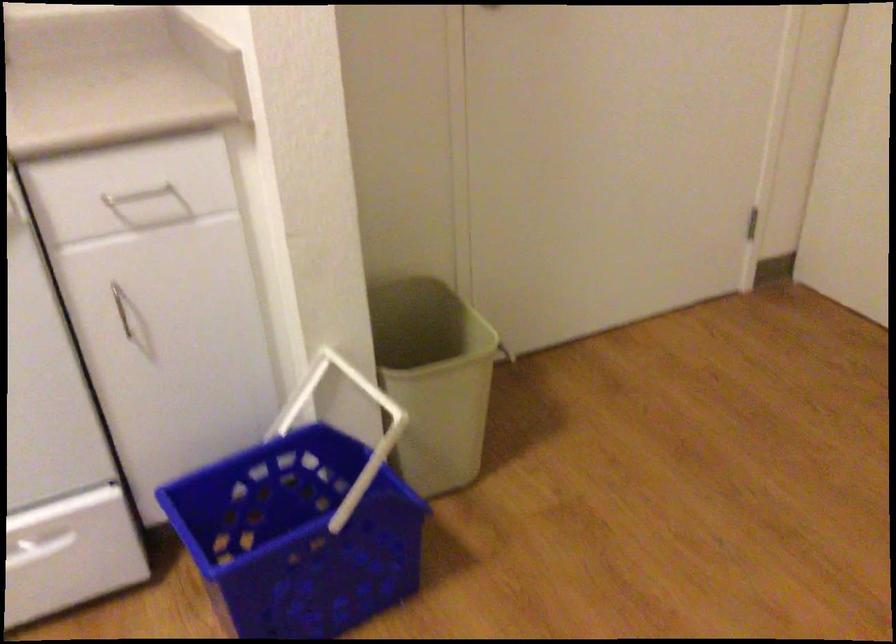
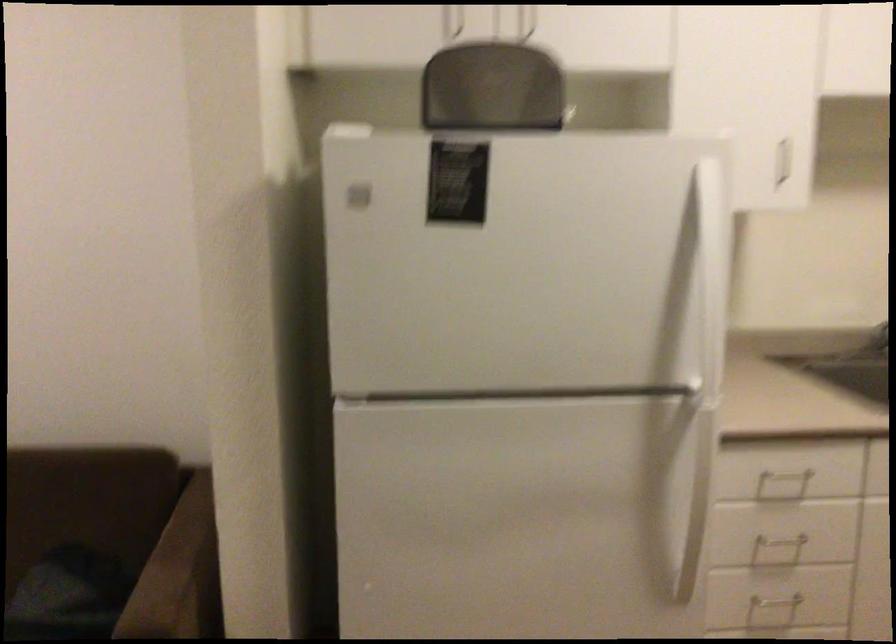
The images are taken continuously from a first-person perspective. In which direction is your viewpoint rotating?

The camera's rotation is toward left-down.